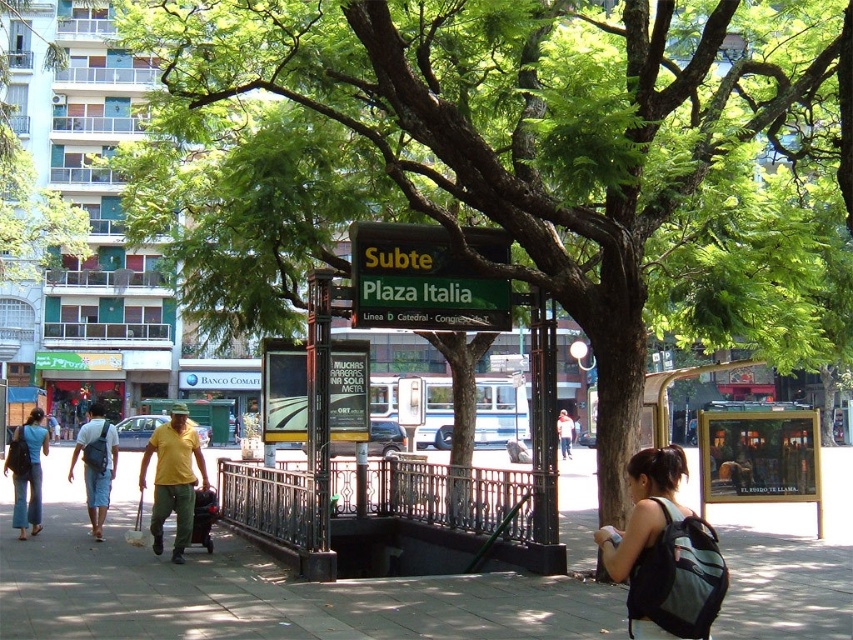
Locate an element on the screen. The image size is (853, 640). light blue denim shorts at lower left is located at coordinates (96, 467).

Is point (100, 422) positioned behind point (561, 417)?

No, (100, 422) is closer to viewer.

Identify the location of light blue denim shorts at lower left. The width and height of the screenshot is (853, 640). (96, 467).

Who is more distant from viewer, (695, 589) or (102, 531)?

The point (102, 531) is behind.

Which of these two, black backpack at lower right or light blue denim shorts at lower left, stands taller?

light blue denim shorts at lower left is taller.

Where is `black backpack at lower right`? The width and height of the screenshot is (853, 640). black backpack at lower right is located at coordinates (664, 554).

Who is positioned more to the right, gray concrete pavement at center or light blue jeans at center?

light blue jeans at center is more to the right.

Which is behind, point (36, 618) or point (572, 428)?

The point (572, 428) is behind.

At what (x,y) coordinates should I click in order to perform the action: click on gray concrete pavement at center. Please return your answer as a coordinate pair (x, y). Looking at the image, I should click on (254, 588).

Locate an element on the screen. This screenshot has width=853, height=640. gray concrete pavement at center is located at coordinates (254, 588).